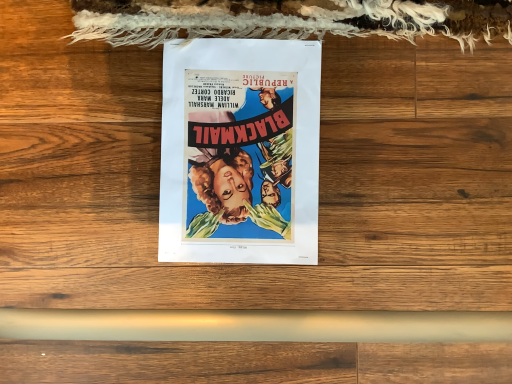
Image resolution: width=512 pixels, height=384 pixels. Describe the element at coordinates (240, 151) in the screenshot. I see `vibrant paper poster at center` at that location.

Find the location of a particular element. vibrant paper poster at center is located at coordinates (240, 151).

Find the location of a particular element. vibrant paper poster at center is located at coordinates (240, 151).